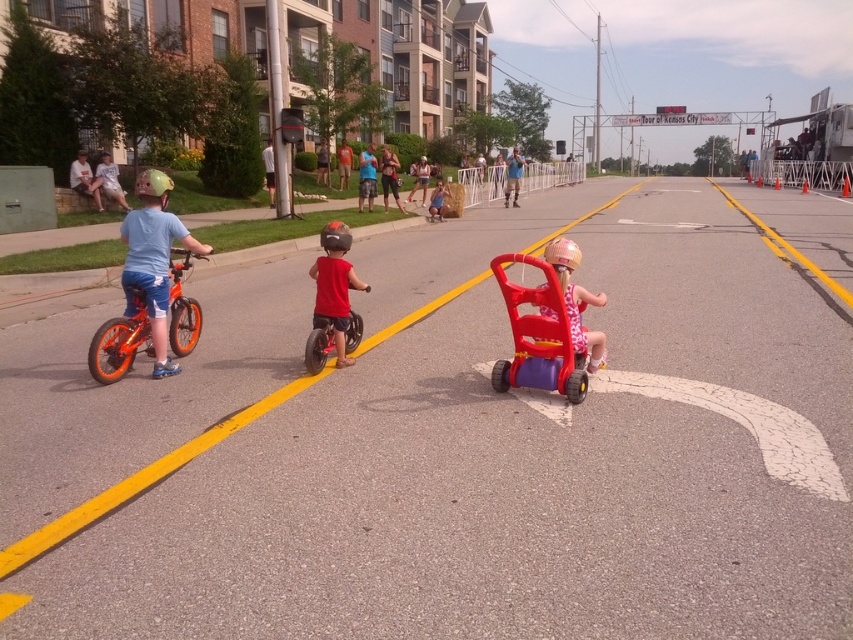
Which of these two, orange matte bicycle at left or metallic silver bicycle at center, stands taller?

Standing taller between the two is orange matte bicycle at left.

Does point (109, 333) come in front of point (311, 371)?

Yes, it is.

Image resolution: width=853 pixels, height=640 pixels. In order to click on orange matte bicycle at left in this screenshot , I will do `click(120, 340)`.

Which of these two, orange matte bicycle at left or matte pink tricycle at center, stands taller?

Standing taller between the two is orange matte bicycle at left.

Between point (181, 260) and point (576, 298), which one is positioned in front?

Positioned in front is point (576, 298).

What do you see at coordinates (120, 340) in the screenshot? This screenshot has width=853, height=640. I see `orange matte bicycle at left` at bounding box center [120, 340].

The image size is (853, 640). In order to click on orange matte bicycle at left in this screenshot , I will do `click(120, 340)`.

Does rubberized plastic baby carriage at center appear over metallic silver bicycle at center?

Yes.

Is rubberized plastic baby carriage at center thinner than metallic silver bicycle at center?

No, rubberized plastic baby carriage at center is not thinner than metallic silver bicycle at center.

Is point (492, 381) positioned before point (317, 324)?

Yes, it is in front of point (317, 324).

The height and width of the screenshot is (640, 853). I want to click on rubberized plastic baby carriage at center, so click(x=538, y=337).